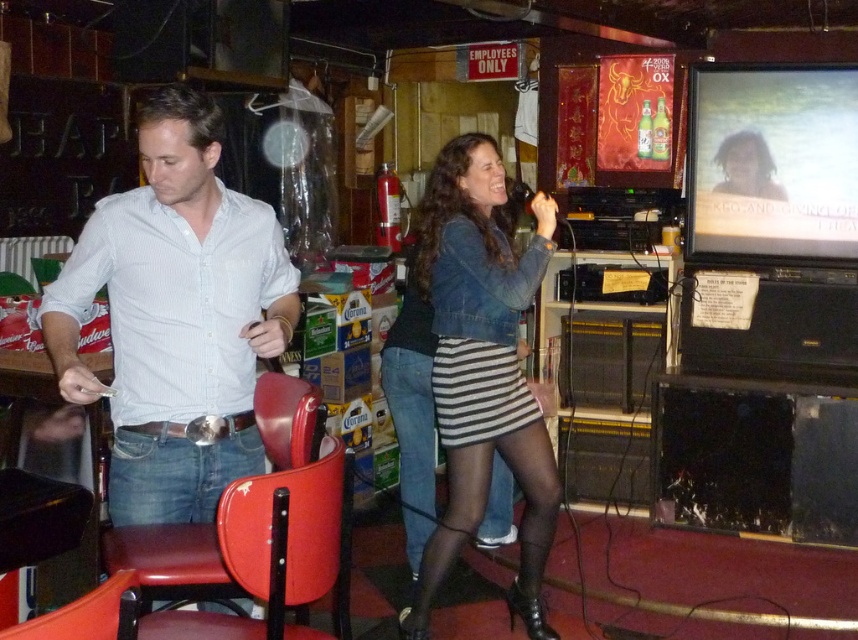
Question: Observing the image, what is the correct spatial positioning of red leather chair at center in reference to striped fabric skirt at center?

Choices:
 (A) above
 (B) below

Answer: (A)

Question: Which object is the closest to the denim jacket at center?

Choices:
 (A) white shirt at left
 (B) matte red chair at center
 (C) striped fabric skirt at center
 (D) white striped shirt at left

Answer: (C)

Question: Is white shirt at left above metallic red chair at lower left?

Choices:
 (A) no
 (B) yes

Answer: (B)

Question: Considering the real-world distances, which object is closest to the red leather chair at center?

Choices:
 (A) white shirt at left
 (B) denim jacket at center
 (C) striped fabric skirt at center

Answer: (A)

Question: Is the position of red leather chair at center more distant than that of metallic red chair at lower left?

Choices:
 (A) yes
 (B) no

Answer: (A)

Question: Which object is positioned farthest from the red leather chair at center?

Choices:
 (A) striped fabric skirt at center
 (B) white striped shirt at left

Answer: (A)